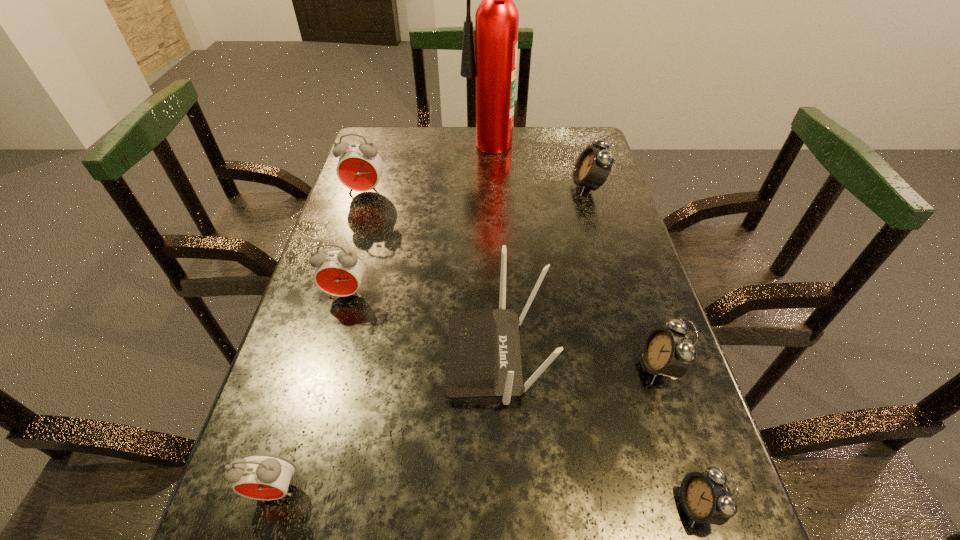
You are a GUI agent. You are given a task and a screenshot of the screen. Output one action in this format:
    pyautogui.click(x=<x>, y=<y>)
    Task: Click on the nearest red alarm clock
    The width and height of the screenshot is (960, 540).
    Given the screenshot: What is the action you would take?
    pyautogui.click(x=258, y=476)

You are a GUI agent. You are given a task and a screenshot of the screen. Output one action in this format:
    pyautogui.click(x=<x>, y=<y>)
    Task: Click on the shortest alarm clock
    
    Given the screenshot: What is the action you would take?
    pyautogui.click(x=706, y=498)

Locate an element on the screen. This screenshot has height=540, width=960. the smallest white alarm clock is located at coordinates (706, 498).

Where is `free space located at the nozzle of the red fire extinguisher`? free space located at the nozzle of the red fire extinguisher is located at coordinates (440, 151).

Where is `vacant point located at the nozzle of the red fire extinguisher`? Image resolution: width=960 pixels, height=540 pixels. vacant point located at the nozzle of the red fire extinguisher is located at coordinates (404, 151).

The image size is (960, 540). I want to click on vacant area located 0.240m at the nozzle of the red fire extinguisher, so click(385, 151).

Image resolution: width=960 pixels, height=540 pixels. In order to click on free space located 0.100m on the face of the tallest alarm clock in this screenshot , I will do `click(356, 222)`.

Locate an element on the screen. The image size is (960, 540). vacant space located 0.070m on the front-facing side of the router is located at coordinates 411,357.

I want to click on vacant space situated on the front-facing side of the router, so click(x=411, y=357).

Where is `vacant space located on the front-facing side of the router`? Image resolution: width=960 pixels, height=540 pixels. vacant space located on the front-facing side of the router is located at coordinates (370, 357).